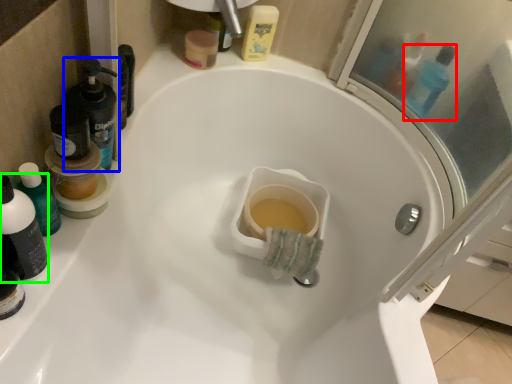
Question: Which is farther away from mouthwash (highlighted by a red box)? mouthwash (highlighted by a blue box) or mouthwash (highlighted by a green box)?

Choices:
 (A) mouthwash
 (B) mouthwash

Answer: (B)